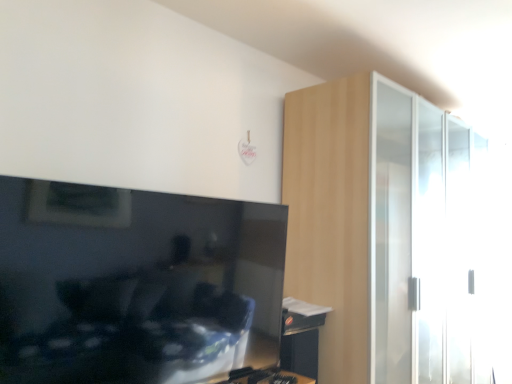
Question: Is matte black tv at left further to the viewer compared to light wood dresser at right?

Choices:
 (A) no
 (B) yes

Answer: (A)

Question: Considering the relative positions of matte black tv at left and light wood dresser at right in the image provided, is matte black tv at left to the left of light wood dresser at right from the viewer's perspective?

Choices:
 (A) yes
 (B) no

Answer: (A)

Question: From a real-world perspective, is matte black tv at left located beneath light wood dresser at right?

Choices:
 (A) yes
 (B) no

Answer: (A)

Question: Does matte black tv at left have a lesser height compared to light wood dresser at right?

Choices:
 (A) no
 (B) yes

Answer: (B)

Question: From a real-world perspective, is matte black tv at left located higher than light wood dresser at right?

Choices:
 (A) yes
 (B) no

Answer: (B)

Question: Considering the positions of light wood dresser at right and wooden table at lower right in the image, is light wood dresser at right wider or thinner than wooden table at lower right?

Choices:
 (A) wide
 (B) thin

Answer: (A)

Question: Do you think light wood dresser at right is within wooden table at lower right, or outside of it?

Choices:
 (A) inside
 (B) outside

Answer: (B)

Question: Considering the positions of light wood dresser at right and wooden table at lower right in the image, is light wood dresser at right bigger or smaller than wooden table at lower right?

Choices:
 (A) big
 (B) small

Answer: (A)

Question: From the image's perspective, relative to wooden table at lower right, is light wood dresser at right above or below?

Choices:
 (A) above
 (B) below

Answer: (A)

Question: Considering the positions of wooden table at lower right and light wood dresser at right in the image, is wooden table at lower right taller or shorter than light wood dresser at right?

Choices:
 (A) short
 (B) tall

Answer: (A)

Question: In terms of width, does wooden table at lower right look wider or thinner when compared to light wood dresser at right?

Choices:
 (A) thin
 (B) wide

Answer: (A)

Question: Is wooden table at lower right in front of or behind light wood dresser at right in the image?

Choices:
 (A) behind
 (B) front

Answer: (A)

Question: From the image's perspective, relative to light wood dresser at right, is wooden table at lower right above or below?

Choices:
 (A) above
 (B) below

Answer: (B)

Question: From the image's perspective, is wooden table at lower right above or below matte black tv at left?

Choices:
 (A) below
 (B) above

Answer: (A)

Question: Is wooden table at lower right wider or thinner than matte black tv at left?

Choices:
 (A) wide
 (B) thin

Answer: (A)